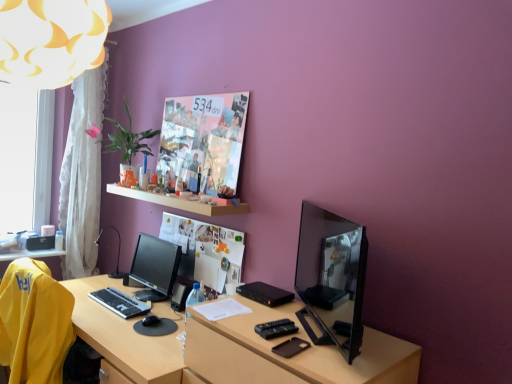
Identify the location of unoccupied region to the right of black plastic keyboard at lower left. (161, 307).